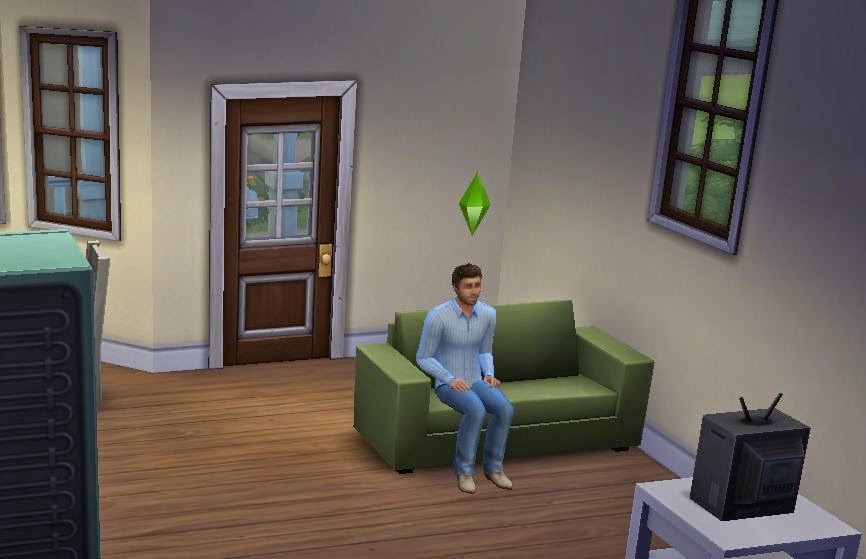
Where is `floor`? Image resolution: width=866 pixels, height=559 pixels. floor is located at coordinates (313, 492).